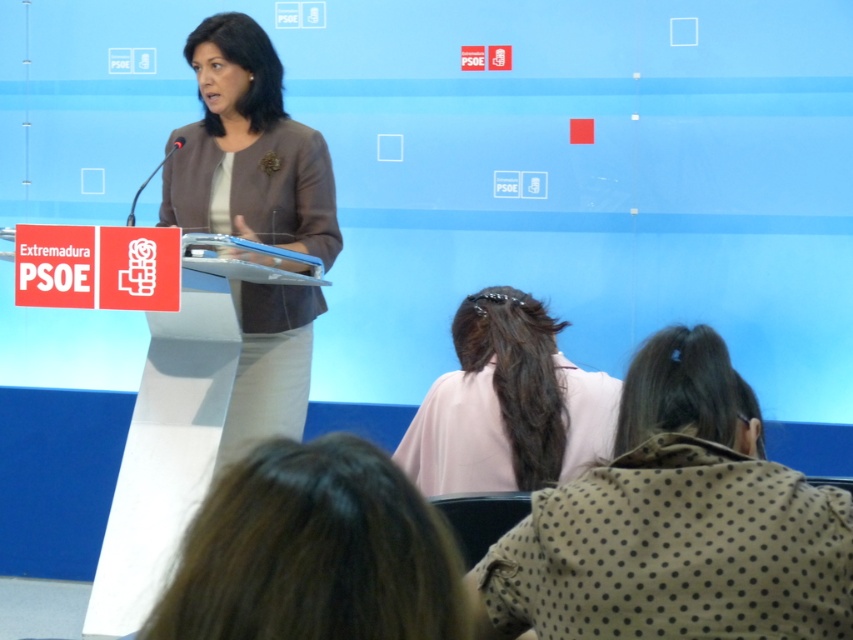
Question: Observing the image, what is the correct spatial positioning of brown dotted fabric at lower center in reference to matte brown blazer at center?

Choices:
 (A) below
 (B) above

Answer: (A)

Question: Is brown dotted fabric at lower center positioned behind brown hair at lower center?

Choices:
 (A) yes
 (B) no

Answer: (A)

Question: Does brown hair at lower center have a smaller size compared to matte brown blazer at center?

Choices:
 (A) yes
 (B) no

Answer: (A)

Question: Which of the following is the farthest from the observer?

Choices:
 (A) (242, 401)
 (B) (376, 454)
 (C) (743, 396)
 (D) (468, 420)

Answer: (A)

Question: Estimate the real-world distances between objects in this image. Which object is closer to the brown hair at lower center?

Choices:
 (A) light pink fabric at center
 (B) matte brown blazer at center

Answer: (A)

Question: Among these objects, which one is nearest to the camera?

Choices:
 (A) matte brown blazer at center
 (B) light pink fabric at center
 (C) brown hair at lower center

Answer: (C)